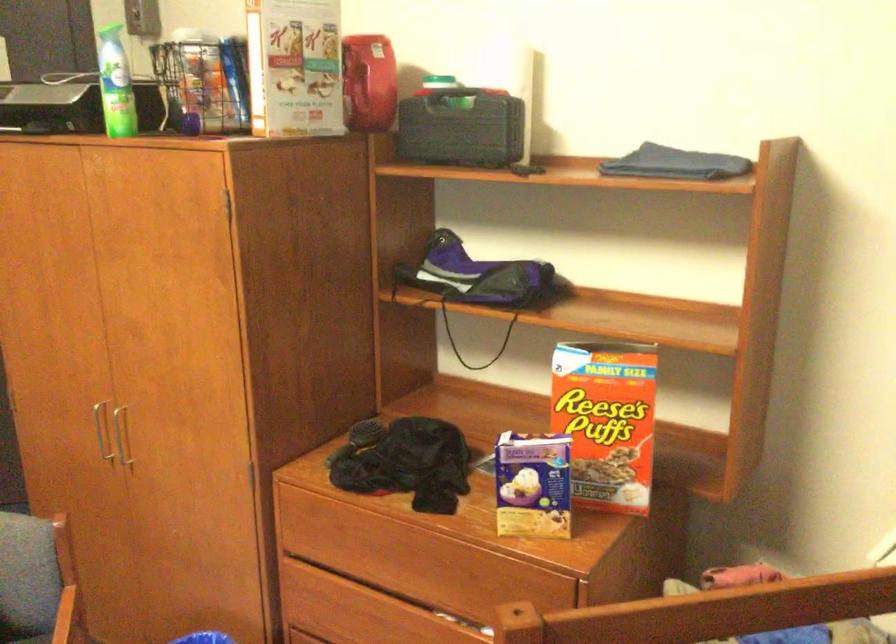
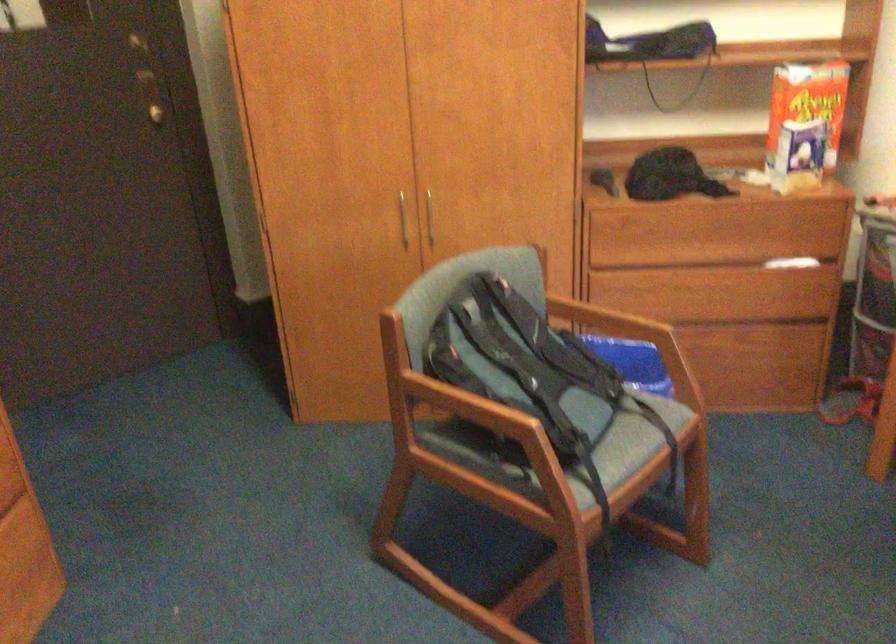
In the second image, find the point that corresponds to the point at 134,444 in the first image.

(428, 218)